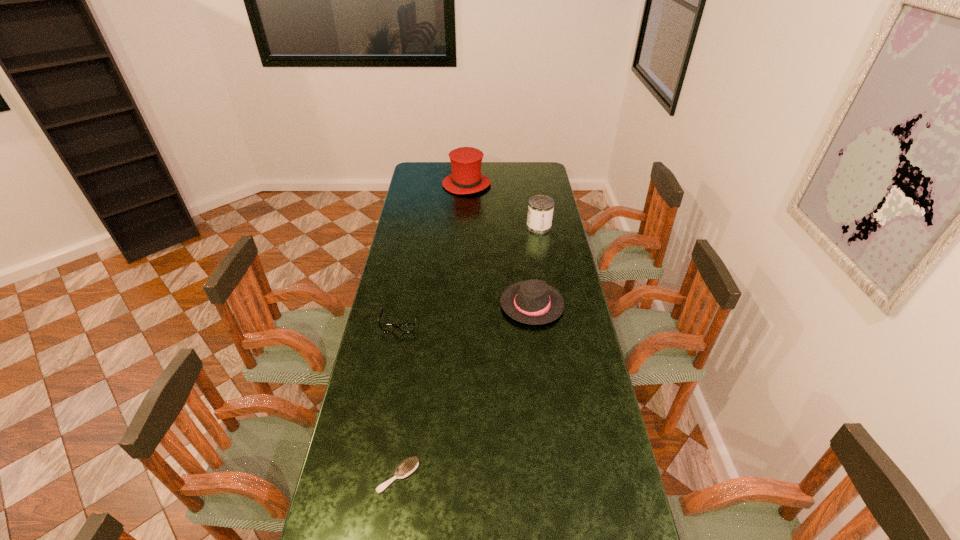
This screenshot has height=540, width=960. In order to click on free space located on the back of the second tallest object in this screenshot , I will do `click(533, 194)`.

I want to click on blank area located on the back of the third shortest object, so click(x=528, y=270).

At what (x,y) coordinates should I click in order to perform the action: click on vacant point located 0.180m on the front-facing side of the second shortest object. Please return your answer as a coordinate pair (x, y). Image resolution: width=960 pixels, height=540 pixels. Looking at the image, I should click on (390, 374).

Where is `free region located 0.370m on the right of the shortest object`? The width and height of the screenshot is (960, 540). free region located 0.370m on the right of the shortest object is located at coordinates (550, 476).

Image resolution: width=960 pixels, height=540 pixels. Find the location of `object located at the far edge`. object located at the far edge is located at coordinates (466, 178).

At what (x,y) coordinates should I click in order to perform the action: click on sunglasses that is at the left edge. Please return your answer as a coordinate pair (x, y). This screenshot has height=540, width=960. Looking at the image, I should click on (385, 327).

The width and height of the screenshot is (960, 540). Find the location of `scrubbing brush positioned at the left edge`. scrubbing brush positioned at the left edge is located at coordinates coord(406,468).

Find the location of `can that is at the right edge`. can that is at the right edge is located at coordinates (540, 208).

Where is `dress hat at the right edge`? The height and width of the screenshot is (540, 960). dress hat at the right edge is located at coordinates (534, 302).

Where is `free space at the far edge of the desktop`? This screenshot has height=540, width=960. free space at the far edge of the desktop is located at coordinates (504, 164).